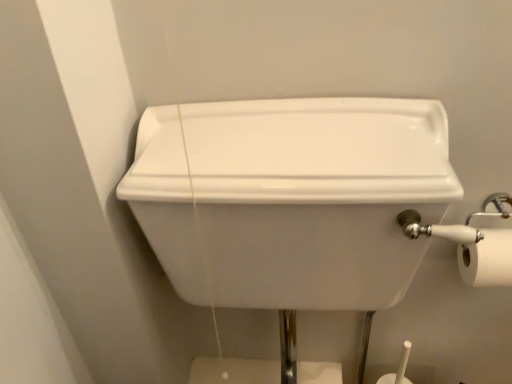
Question: From a real-world perspective, is white matte toilet paper at right physically located above or below white glossy sink at center?

Choices:
 (A) above
 (B) below

Answer: (A)

Question: Visually, is white matte toilet paper at right positioned to the left or to the right of white glossy sink at center?

Choices:
 (A) left
 (B) right

Answer: (B)

Question: Does point (471, 261) appear closer or farther from the camera than point (266, 182)?

Choices:
 (A) closer
 (B) farther

Answer: (B)

Question: Is white glossy sink at center inside the boundaries of white matte toilet paper at right, or outside?

Choices:
 (A) outside
 (B) inside

Answer: (A)

Question: Does point (190, 299) appear closer or farther from the camera than point (489, 236)?

Choices:
 (A) farther
 (B) closer

Answer: (B)

Question: Looking at the image, does white glossy sink at center seem bigger or smaller compared to white matte toilet paper at right?

Choices:
 (A) small
 (B) big

Answer: (B)

Question: From the image's perspective, is white glossy sink at center located above or below white matte toilet paper at right?

Choices:
 (A) above
 (B) below

Answer: (B)